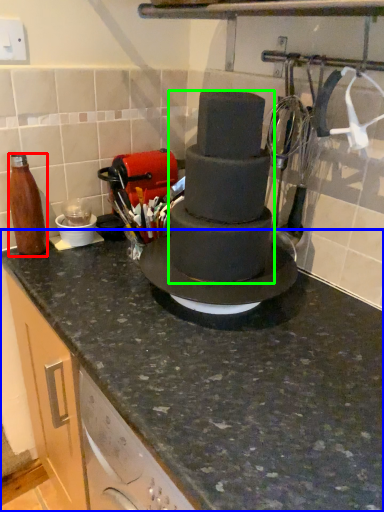
Question: Which is farther away from bottle (highlighted by a red box)? countertop (highlighted by a blue box) or chocolate cake (highlighted by a green box)?

Choices:
 (A) countertop
 (B) chocolate cake

Answer: (A)